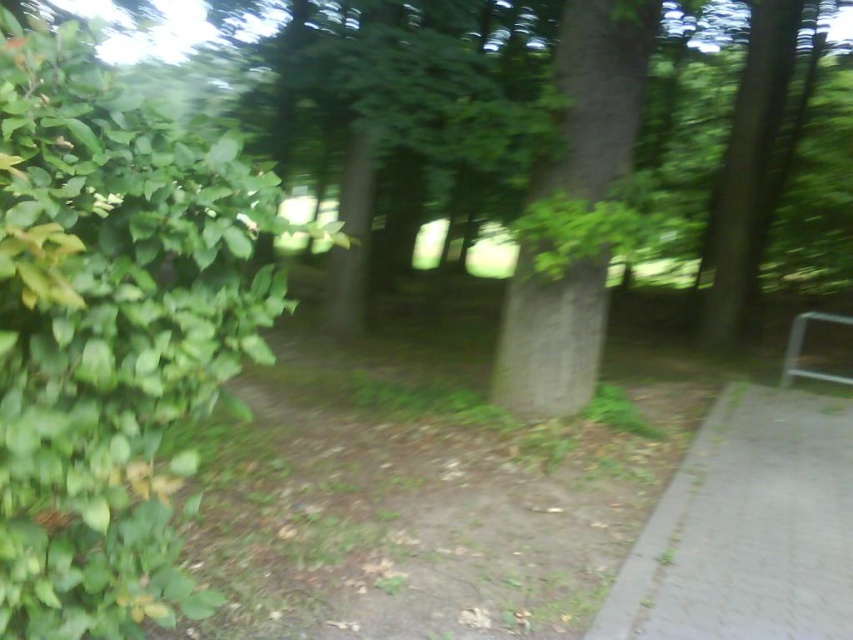
Question: Is green leafy bush at left below gray concrete pavement at lower right?

Choices:
 (A) yes
 (B) no

Answer: (B)

Question: Among these points, which one is nearest to the camera?

Choices:
 (A) (828, 595)
 (B) (561, 156)

Answer: (A)

Question: Can you confirm if green leafy bush at left is thinner than green rough bark tree at center?

Choices:
 (A) yes
 (B) no

Answer: (B)

Question: Which of the following is the farthest from the observer?

Choices:
 (A) (601, 108)
 (B) (793, 556)
 (C) (149, 461)

Answer: (A)

Question: Is green leafy bush at left closer to the viewer compared to gray concrete pavement at lower right?

Choices:
 (A) yes
 (B) no

Answer: (A)

Question: Which object appears closest to the camera in this image?

Choices:
 (A) green leafy bush at left
 (B) green rough bark tree at center
 (C) gray concrete pavement at lower right

Answer: (A)